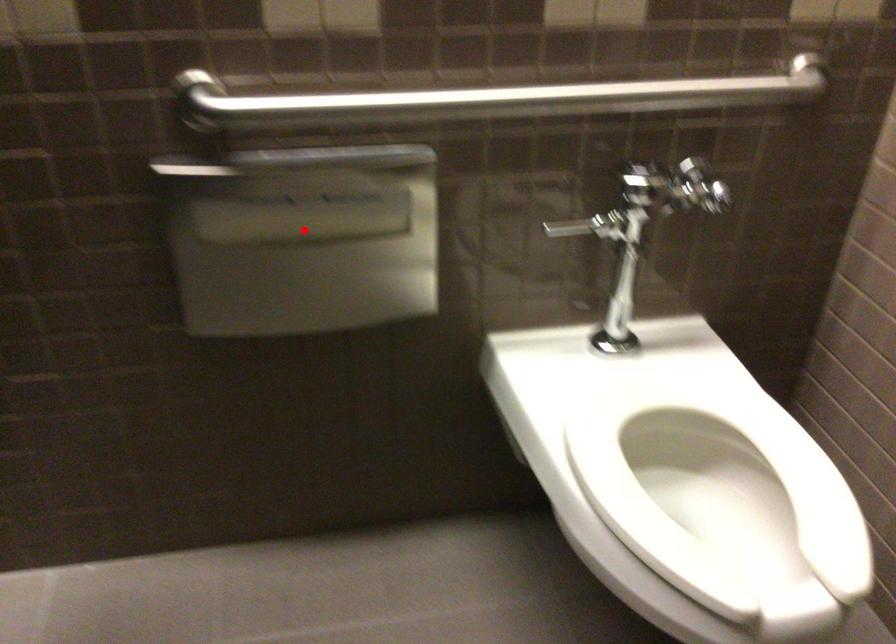
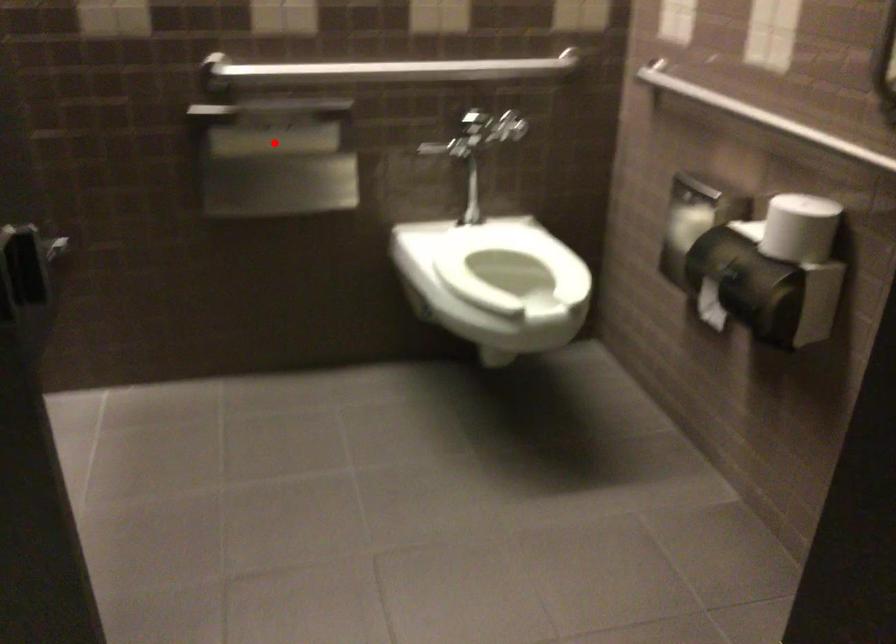
I am providing you with two images of the same scene from different viewpoints. A red point is marked on the first image and another point is marked on the second image. Are the points marked in image1 and image2 representing the same 3D position?

Yes